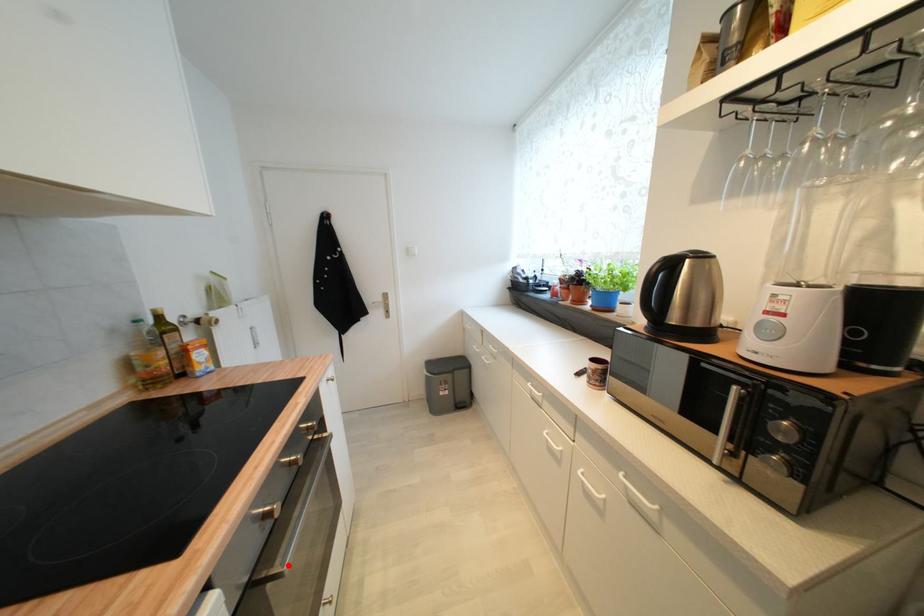
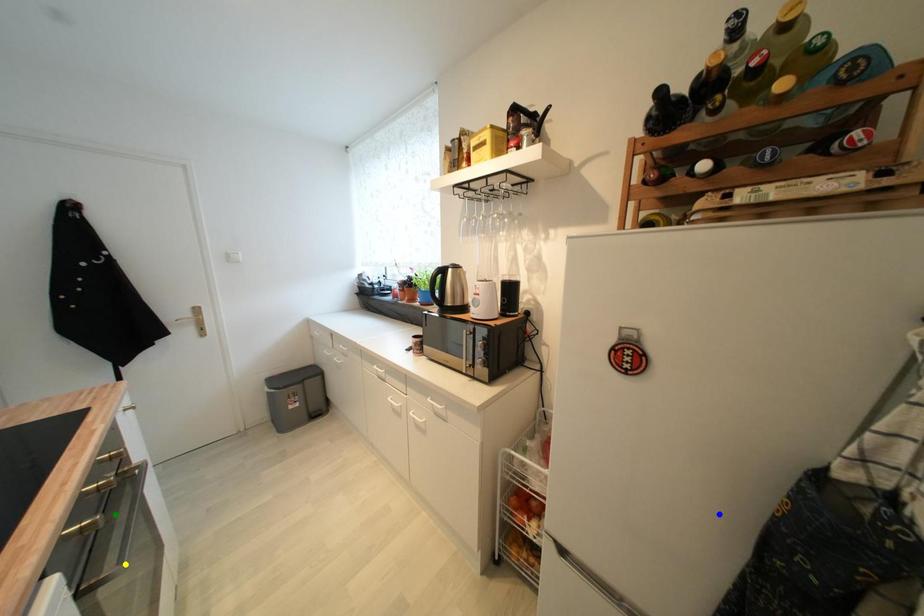
Question: I am providing you with two images of the same scene from different viewpoints. A red point is marked on the first image. You are given multiple points on the second image. In image 2, which mark is for the same physical point as the one in image 1?

Choices:
 (A) green point
 (B) blue point
 (C) yellow point

Answer: (C)